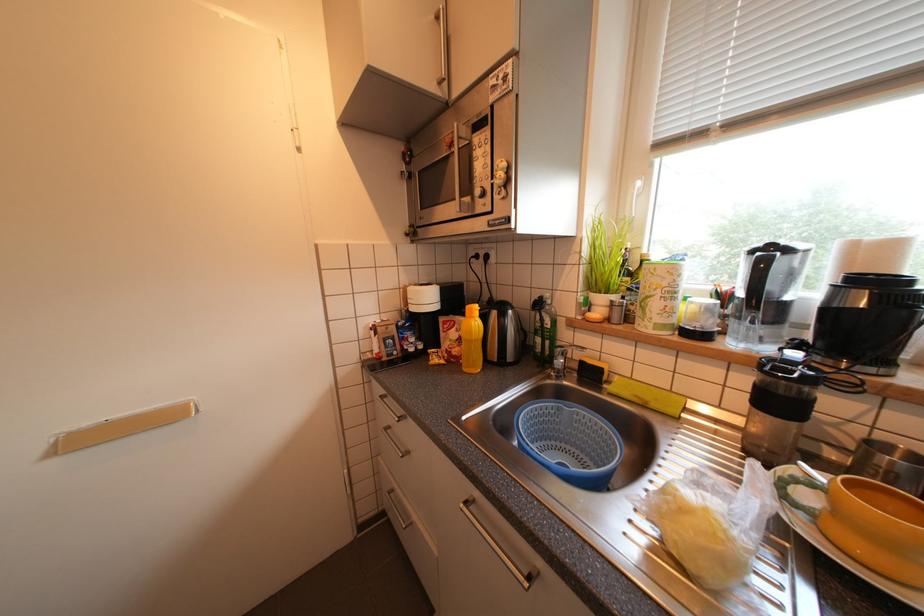
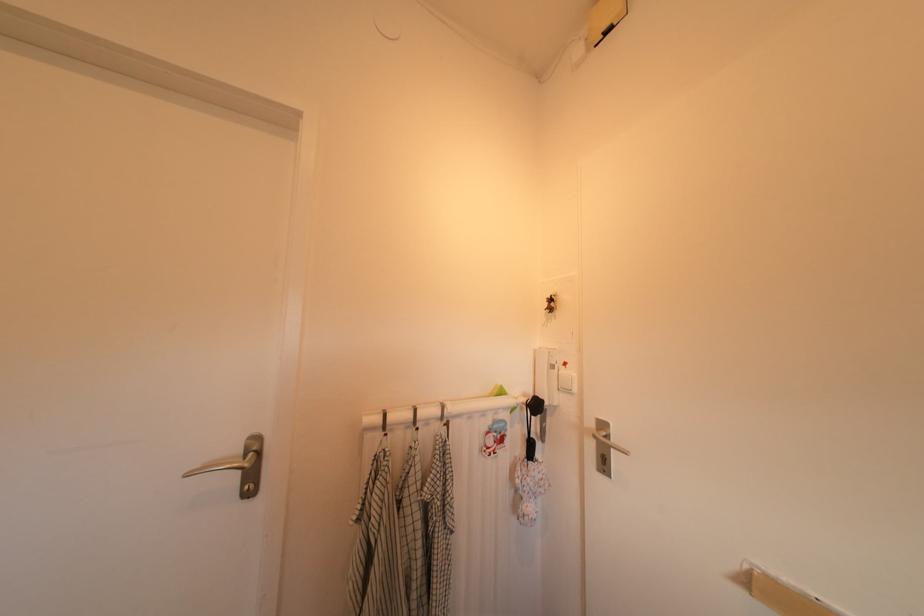
Question: The camera is either moving clockwise (left) or counter-clockwise (right) around the object. The first image is from the beginning of the video and the second image is from the end. Is the camera moving left or right when shooting the video?

Choices:
 (A) Left
 (B) Right

Answer: (B)